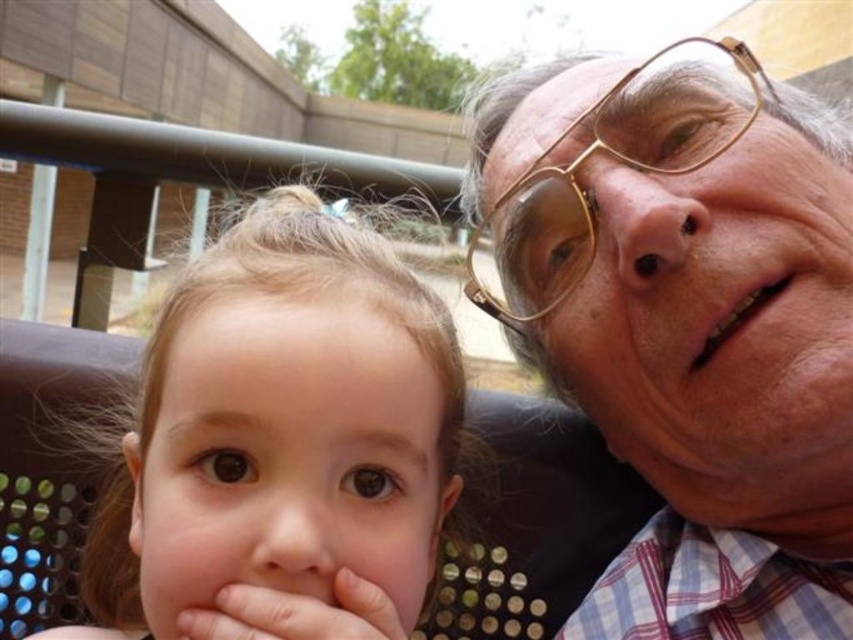
Based on the scene description, can you determine if the smooth skin baby at center is closer to the viewer than the gold metallic glasses at upper right?

Yes, the smooth skin baby at center is in front of the gold metallic glasses at upper right, so it is closer to the viewer.

You are a photographer trying to capture a close portrait of both the matte gold glasses at upper right and the gold metallic glasses at upper right in the scene. Based on their positions, which glasses are positioned higher in the frame?

The matte gold glasses at upper right are positioned higher in the frame than the gold metallic glasses at upper right because they are described as much taller.